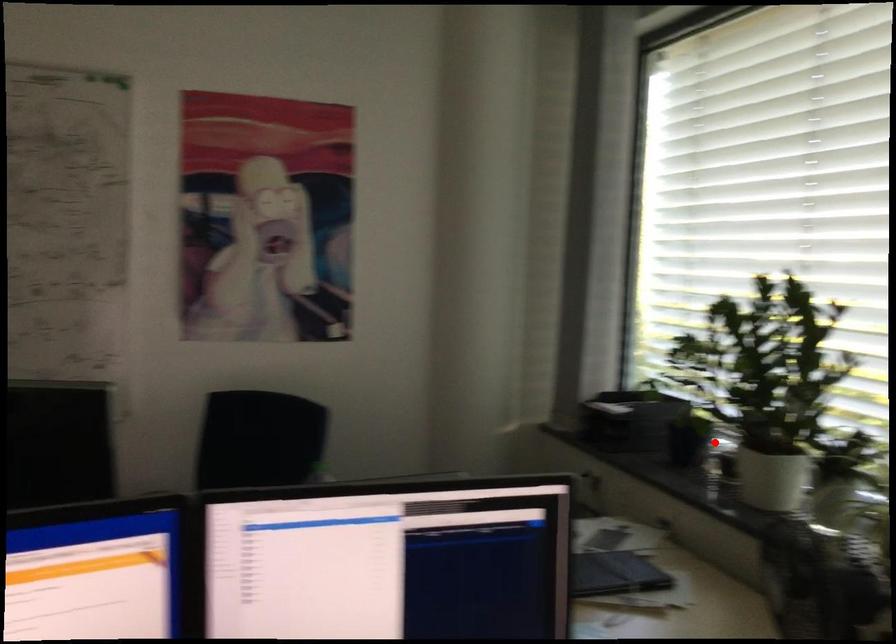
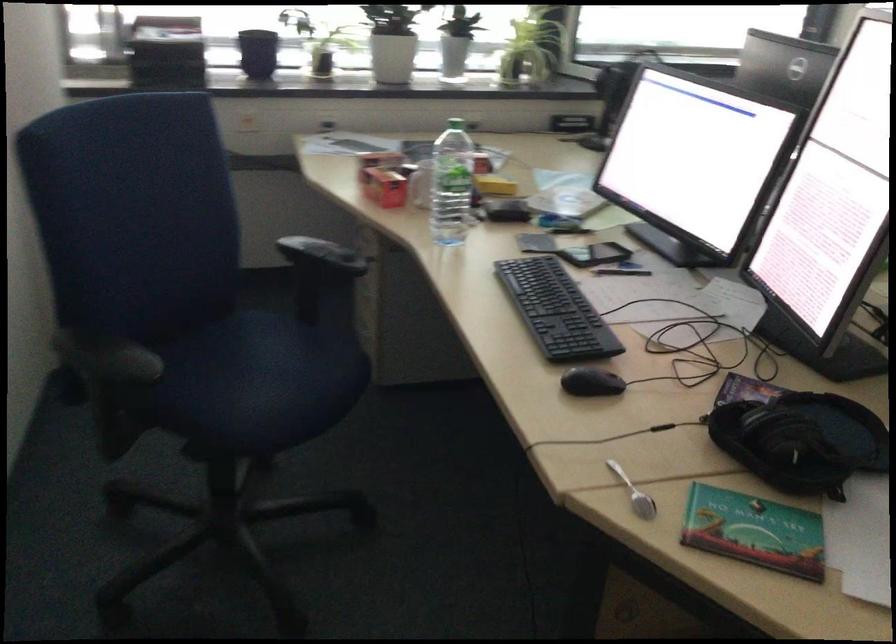
In the second image, find the point that corresponds to the highlighted location in the first image.

(257, 53)